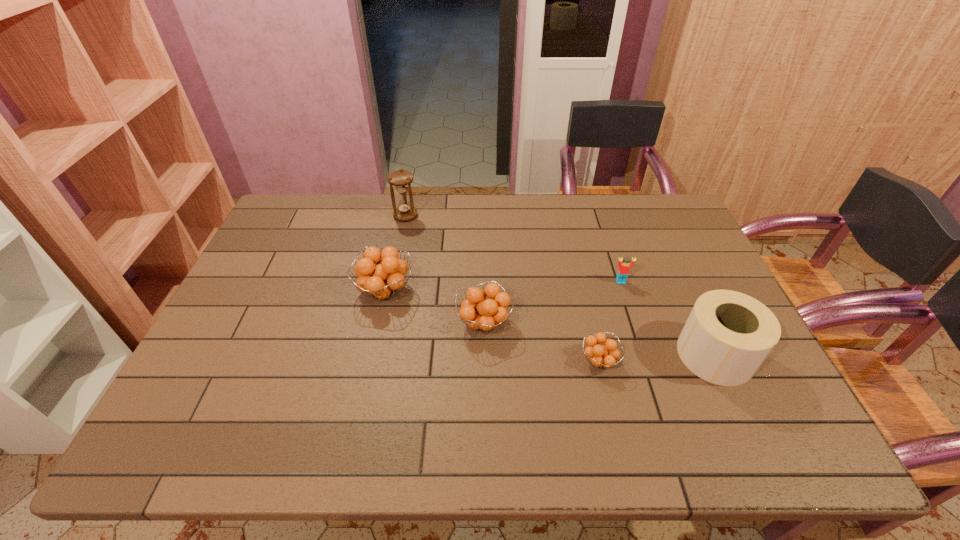
All orange fruits are currently evenly spaced. To continue this pattern, where would you add another orange fruit on the right? Please point out a vacant spot. Please provide its 2D coordinates. Your answer should be formatted as a tuple, i.e. [(x, y)], where the tuple contains the x and y coordinates of a point satisfying the conditions above.

[(735, 406)]